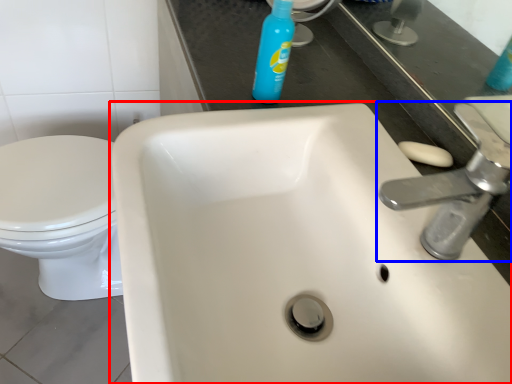
Question: Which of the following is the closest to the observer, sink (highlighted by a red box) or tap (highlighted by a blue box)?

Choices:
 (A) sink
 (B) tap

Answer: (A)